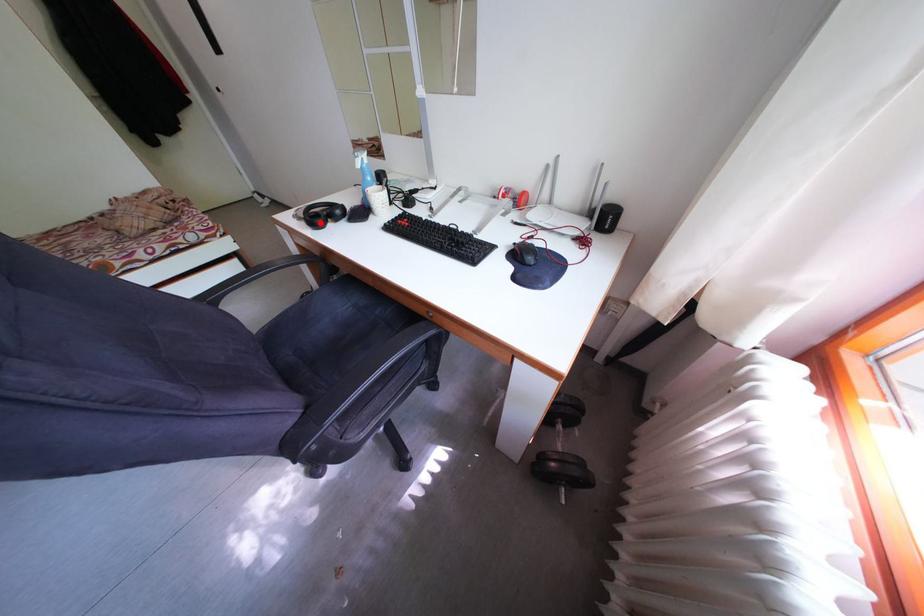
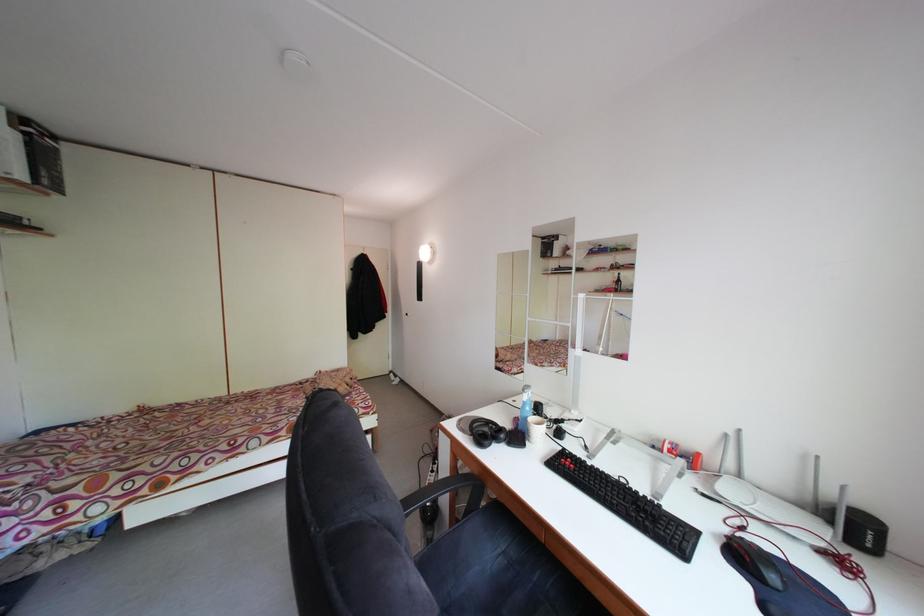
Where in the second image is the point corresponding to the highlighted location from the first image?

(488, 440)